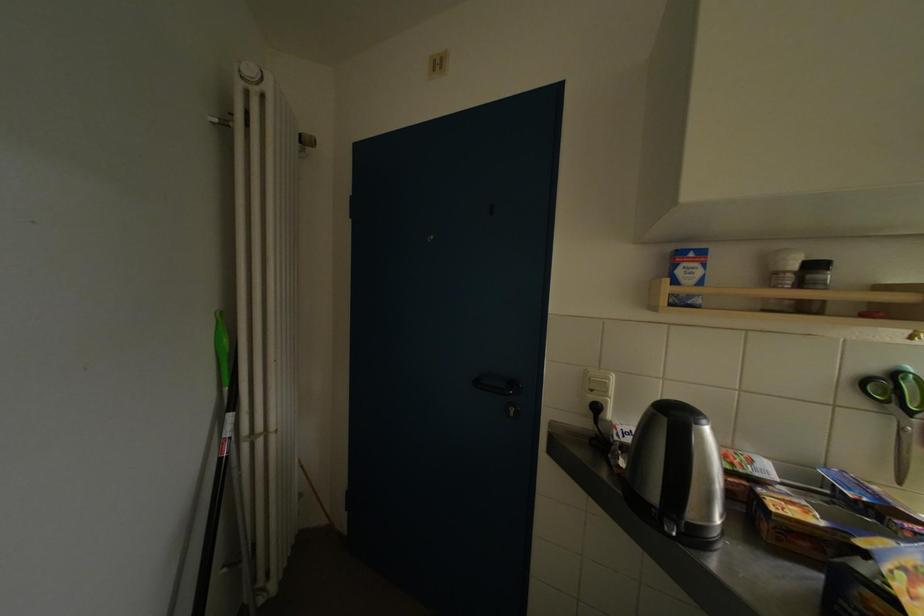
Find where to turn the black door handle. Please return your answer as a coordinate pair (x, y).

(496, 384)